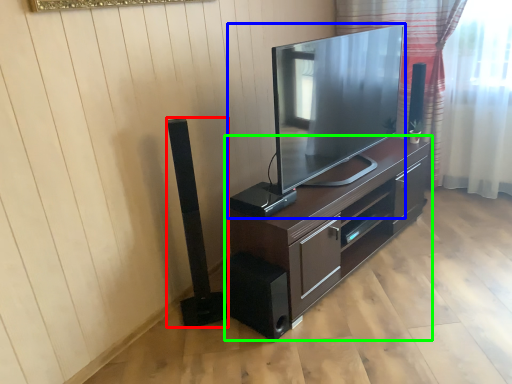
Question: Which object is positioned farthest from speaker (highlighted by a red box)? Select from television (highlighted by a blue box) and cabinetry (highlighted by a green box).

Choices:
 (A) television
 (B) cabinetry

Answer: (A)